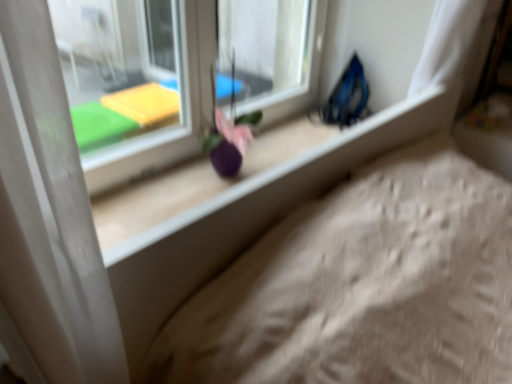
Identify the location of purple matte flower at center. This screenshot has width=512, height=384. (230, 121).

The width and height of the screenshot is (512, 384). Describe the element at coordinates (230, 121) in the screenshot. I see `purple matte flower at center` at that location.

In the scene shown: Measure the distance between matte plastic window at center and camera.

matte plastic window at center is 4.40 feet from camera.

Find the location of a particular element. The width and height of the screenshot is (512, 384). matte plastic window at center is located at coordinates (137, 75).

What do you see at coordinates (137, 75) in the screenshot? The width and height of the screenshot is (512, 384). I see `matte plastic window at center` at bounding box center [137, 75].

This screenshot has width=512, height=384. I want to click on purple matte flower at center, so click(230, 121).

Is purple matte flower at center to the left of matte plastic window at center from the viewer's perspective?

Incorrect, purple matte flower at center is not on the left side of matte plastic window at center.

Is purple matte flower at center in front of or behind matte plastic window at center in the image?

Visually, purple matte flower at center is located behind matte plastic window at center.

Does point (245, 133) come closer to viewer compared to point (314, 51)?

Yes, point (245, 133) is closer to viewer.

From the image's perspective, which object appears higher, purple matte flower at center or matte plastic window at center?

matte plastic window at center, from the image's perspective.

Consider the image. From a real-world perspective, is purple matte flower at center positioned over matte plastic window at center based on gravity?

Incorrect, from a real-world perspective, purple matte flower at center is lower than matte plastic window at center.

Looking at their sizes, would you say purple matte flower at center is wider or thinner than matte plastic window at center?

In the image, purple matte flower at center appears to be wider than matte plastic window at center.

Who is shorter, purple matte flower at center or matte plastic window at center?

With less height is purple matte flower at center.

Consider the image. Based on their sizes in the image, would you say purple matte flower at center is bigger or smaller than matte plastic window at center?

In the image, purple matte flower at center appears to be smaller than matte plastic window at center.

Would you say purple matte flower at center contains matte plastic window at center?

No.

Are purple matte flower at center and matte plastic window at center far apart?

No, there isn't a large distance between purple matte flower at center and matte plastic window at center.

Is purple matte flower at center facing towards matte plastic window at center?

No, purple matte flower at center is not aimed at matte plastic window at center.

How different are the orientations of purple matte flower at center and matte plastic window at center in degrees?

The angle between the facing direction of purple matte flower at center and the facing direction of matte plastic window at center is 3.39 degrees.

How distant is purple matte flower at center from matte plastic window at center?

The distance of purple matte flower at center from matte plastic window at center is 17.87 inches.

You are a GUI agent. You are given a task and a screenshot of the screen. Output one action in this format:
    pyautogui.click(x=<x>, y=<y>)
    Task: Click on the flower that appears behind the matte plastic window at center
    This screenshot has width=512, height=384.
    Given the screenshot: What is the action you would take?
    pyautogui.click(x=230, y=121)

Does matte plastic window at center appear on the right side of purple matte flower at center?

No, matte plastic window at center is not to the right of purple matte flower at center.

Which object is closer to the camera, matte plastic window at center or purple matte flower at center?

matte plastic window at center is in front.

Is point (162, 58) in front of point (260, 114)?

No, (162, 58) is further to viewer.

From the image's perspective, which one is positioned higher, matte plastic window at center or purple matte flower at center?

From the image's view, matte plastic window at center is above.

From a real-world perspective, which object stands above the other?

matte plastic window at center, from a real-world perspective.

In terms of width, does matte plastic window at center look wider or thinner when compared to purple matte flower at center?

Considering their sizes, matte plastic window at center looks slimmer than purple matte flower at center.

In the scene shown: From their relative heights in the image, would you say matte plastic window at center is taller or shorter than purple matte flower at center?

Considering their sizes, matte plastic window at center has more height than purple matte flower at center.

In terms of size, does matte plastic window at center appear bigger or smaller than purple matte flower at center?

In the image, matte plastic window at center appears to be larger than purple matte flower at center.

Would you say matte plastic window at center is inside or outside purple matte flower at center?

matte plastic window at center is outside purple matte flower at center.

Is matte plastic window at center far from purple matte flower at center?

No, there isn't a large distance between matte plastic window at center and purple matte flower at center.

Is matte plastic window at center aimed at purple matte flower at center?

Yes, matte plastic window at center is aimed at purple matte flower at center.

Where is `flower on the right of matte plastic window at center`? Image resolution: width=512 pixels, height=384 pixels. flower on the right of matte plastic window at center is located at coordinates (230, 121).

You are a GUI agent. You are given a task and a screenshot of the screen. Output one action in this format:
    pyautogui.click(x=<x>, y=<y>)
    Task: Click on the window above the purple matte flower at center (from the image's perspective)
    
    Given the screenshot: What is the action you would take?
    pyautogui.click(x=137, y=75)

Identify the location of flower directly beneath the matte plastic window at center (from a real-world perspective). (230, 121).